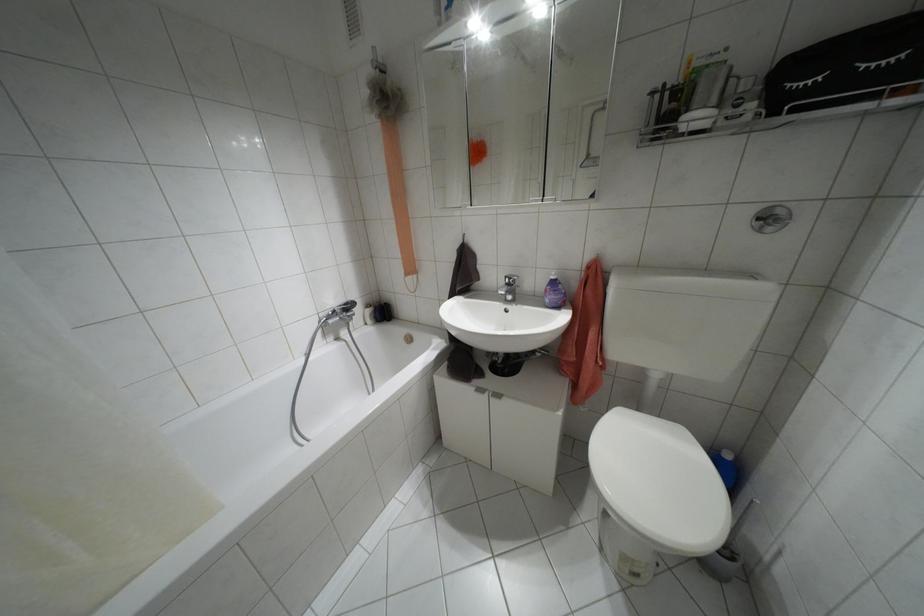
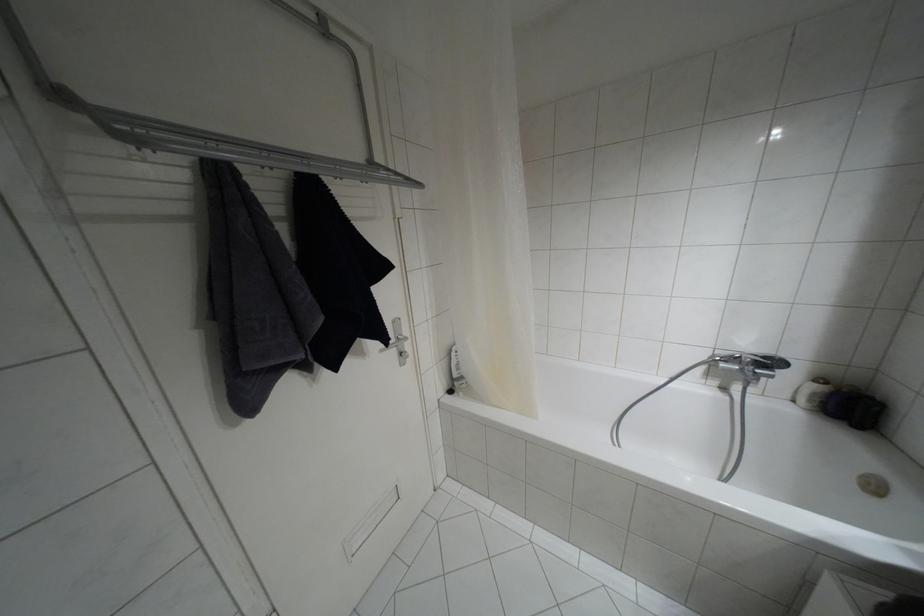
Find the pixel in the second image that matches the point at 345,304 in the first image.

(763, 357)